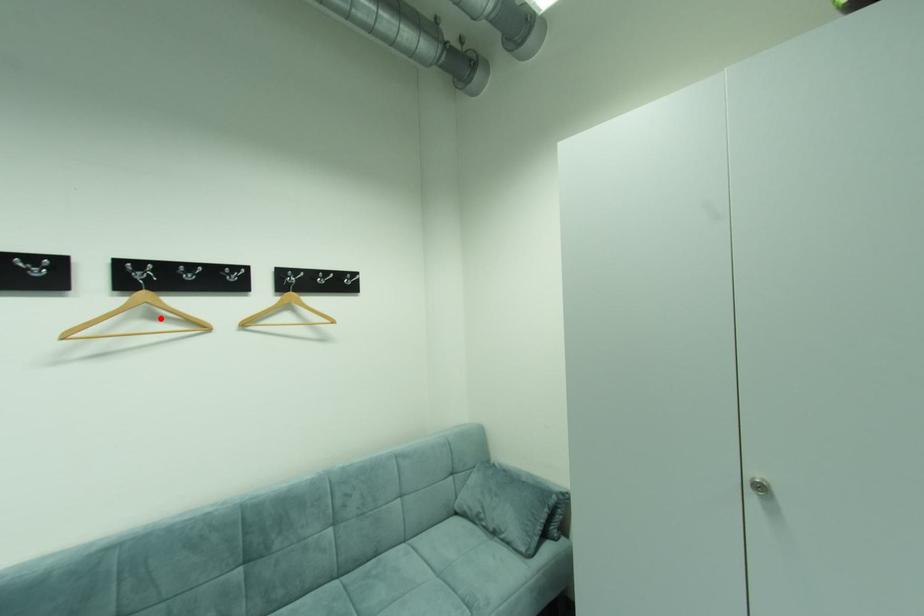
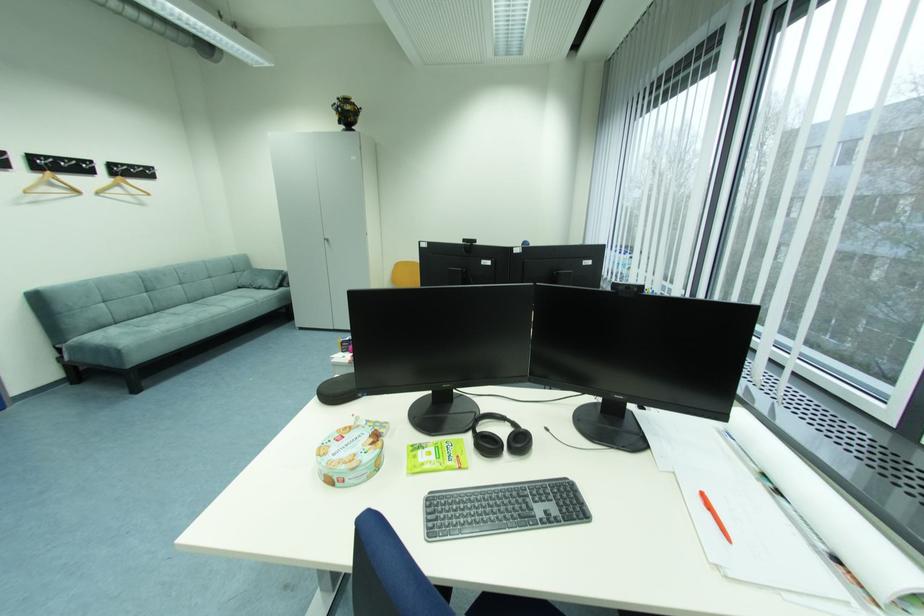
In the second image, find the point that corresponds to the highlighted location in the first image.

(59, 185)